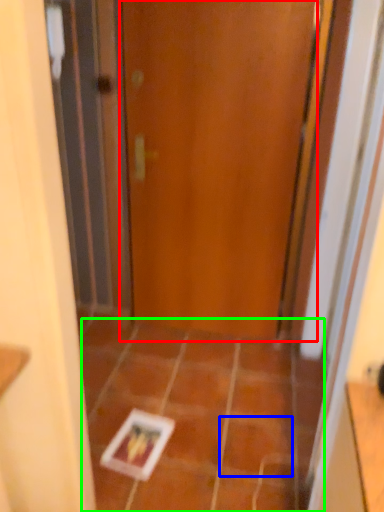
Question: Which object is the closest to the door (highlighted by a red box)? Choose among these: ceramic tile (highlighted by a blue box) or ceramic tile (highlighted by a green box).

Choices:
 (A) ceramic tile
 (B) ceramic tile

Answer: (B)